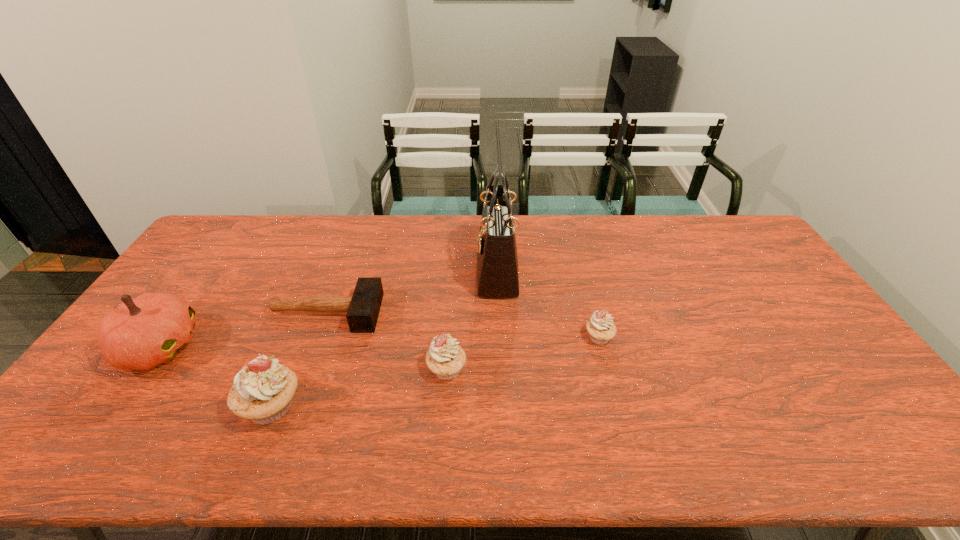
The width and height of the screenshot is (960, 540). What are the coordinates of `free spot that satisfies the following two spatial constraints: 1. on the back side of the rightmost object; 2. on the hammer head face of the mallet` in the screenshot? It's located at (592, 313).

You are a GUI agent. You are given a task and a screenshot of the screen. Output one action in this format:
    pyautogui.click(x=<x>, y=<y>)
    Task: Click on the free spot that satisfies the following two spatial constraints: 1. on the back side of the second tallest cupcake; 2. on the hammer head face of the mallet
    
    Given the screenshot: What is the action you would take?
    pyautogui.click(x=451, y=313)

Find the location of a particular element. The width and height of the screenshot is (960, 540). vacant region that satisfies the following two spatial constraints: 1. on the front-facing side of the second tallest cupcake; 2. on the left side of the leftmost object is located at coordinates tap(144, 369).

Identify the location of free point that satisfies the following two spatial constraints: 1. at the front of the rightmost cupcake with visible charms; 2. on the left side of the tallest object. (500, 337).

At what (x,y) coordinates should I click in order to perform the action: click on vacant region that satisfies the following two spatial constraints: 1. on the back side of the shortest cupcake; 2. at the front of the tallest object with visible charms. Please return your answer as a coordinate pair (x, y). This screenshot has width=960, height=540. Looking at the image, I should click on (582, 271).

At what (x,y) coordinates should I click in order to perform the action: click on vacant point that satisfies the following two spatial constraints: 1. on the hammer head face of the shortest object; 2. on the back side of the rightmost object. Please return your answer as a coordinate pair (x, y). The width and height of the screenshot is (960, 540). Looking at the image, I should click on click(318, 337).